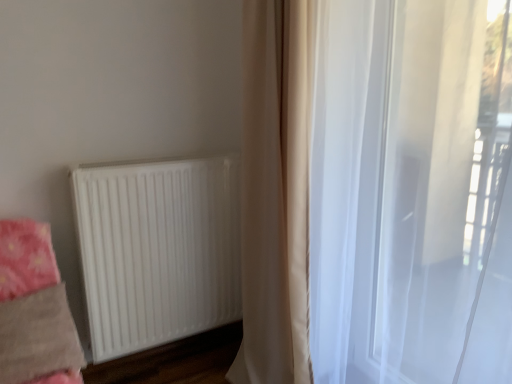
Question: Is white matte radiator at lower left not close to beige fabric curtain at center, placed as the 1th curtain when sorted from left to right?

Choices:
 (A) yes
 (B) no

Answer: (B)

Question: From the image's perspective, is white matte radiator at lower left located above beige fabric curtain at center, which appears as the second curtain when viewed from the right?

Choices:
 (A) yes
 (B) no

Answer: (B)

Question: Considering the relative sizes of white matte radiator at lower left and beige fabric curtain at center, which appears as the second curtain when viewed from the right, in the image provided, is white matte radiator at lower left thinner than beige fabric curtain at center, which appears as the second curtain when viewed from the right,?

Choices:
 (A) no
 (B) yes

Answer: (B)

Question: Is white matte radiator at lower left outside of beige fabric curtain at center, placed as the 1th curtain when sorted from left to right?

Choices:
 (A) no
 (B) yes

Answer: (B)

Question: Could beige fabric curtain at center, placed as the 1th curtain when sorted from left to right, be considered to be inside white matte radiator at lower left?

Choices:
 (A) no
 (B) yes

Answer: (A)

Question: Considering the positions of beige fabric curtain at center, placed as the 1th curtain when sorted from left to right, and fluffy pink blanket at lower left in the image, is beige fabric curtain at center, placed as the 1th curtain when sorted from left to right, wider or thinner than fluffy pink blanket at lower left?

Choices:
 (A) wide
 (B) thin

Answer: (A)

Question: Is beige fabric curtain at center, which appears as the second curtain when viewed from the right, to the left or to the right of fluffy pink blanket at lower left in the image?

Choices:
 (A) left
 (B) right

Answer: (B)

Question: From a real-world perspective, is beige fabric curtain at center, placed as the 1th curtain when sorted from left to right, physically located above or below fluffy pink blanket at lower left?

Choices:
 (A) above
 (B) below

Answer: (A)

Question: Would you say beige fabric curtain at center, which appears as the second curtain when viewed from the right, is inside or outside fluffy pink blanket at lower left?

Choices:
 (A) outside
 (B) inside

Answer: (A)

Question: Considering their positions, is translucent white curtain at right, acting as the 2th curtain starting from the left, located in front of or behind white matte radiator at lower left?

Choices:
 (A) behind
 (B) front

Answer: (B)

Question: Considering the positions of point (393, 375) and point (173, 230), is point (393, 375) closer or farther from the camera than point (173, 230)?

Choices:
 (A) farther
 (B) closer

Answer: (B)

Question: From a real-world perspective, is translucent white curtain at right, which is counted as the first curtain, starting from the right, above or below white matte radiator at lower left?

Choices:
 (A) above
 (B) below

Answer: (A)

Question: Is translucent white curtain at right, which is counted as the first curtain, starting from the right, wider or thinner than white matte radiator at lower left?

Choices:
 (A) thin
 (B) wide

Answer: (B)

Question: In terms of width, does translucent white curtain at right, acting as the 2th curtain starting from the left, look wider or thinner when compared to beige fabric curtain at center, placed as the 1th curtain when sorted from left to right?

Choices:
 (A) thin
 (B) wide

Answer: (A)

Question: From the image's perspective, is translucent white curtain at right, acting as the 2th curtain starting from the left, above or below beige fabric curtain at center, placed as the 1th curtain when sorted from left to right?

Choices:
 (A) above
 (B) below

Answer: (B)